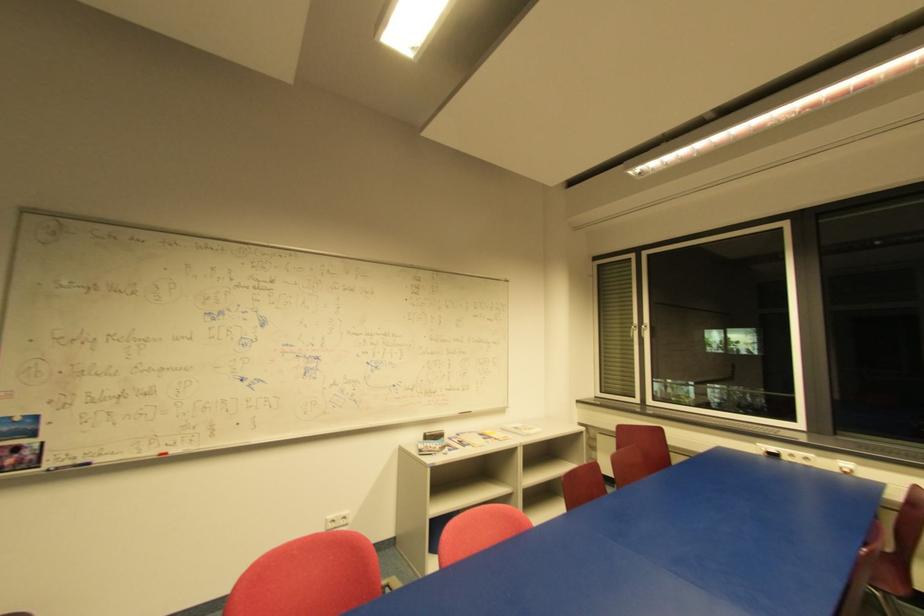
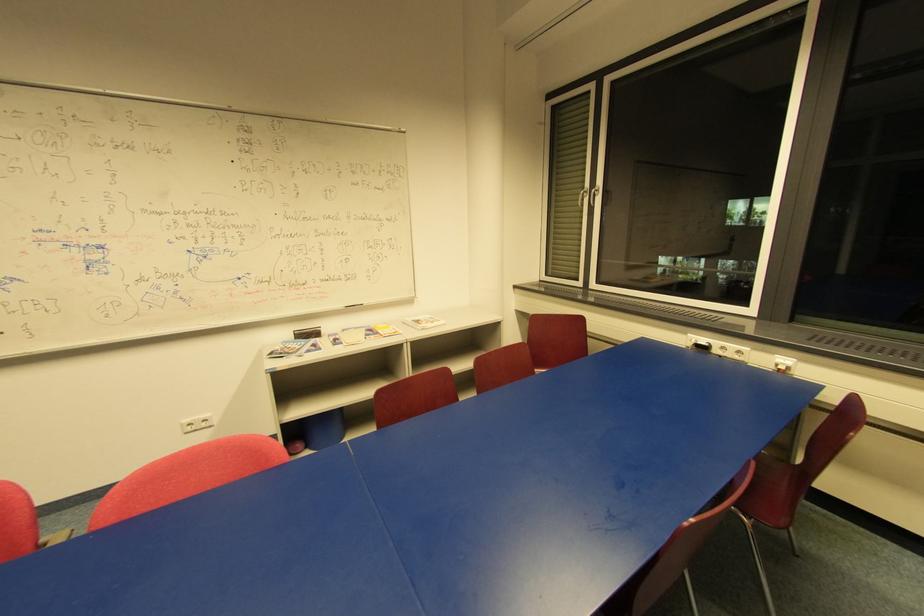
Where in the second image is the point corresponding to point 494,439 from the first image?

(381, 334)